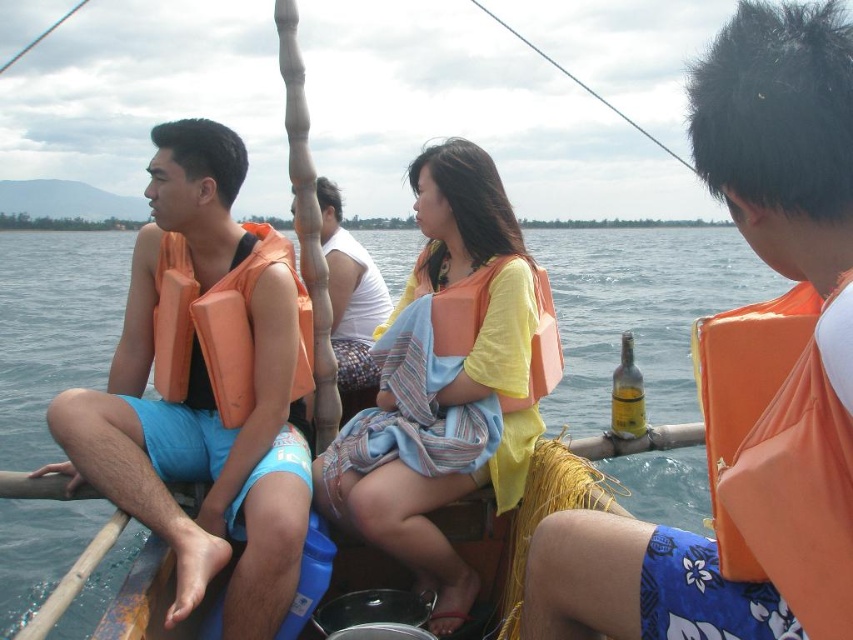
You are on a boat and need to retrieve the orange life vest at right. Which direction should you move relative to the matte orange life vest at left to reach it?

The orange life vest at right is behind the matte orange life vest at left, so you should move backward from the matte orange life vest at left to reach it.

You are a tour guide who needs to ensure safety between the two life vests. The minimum safe distance between life vests on this boat is 10 feet. Are the matte orange life vest at left and orange life vest at center spaced safely apart?

The matte orange life vest at left and orange life vest at center are 10.84 feet apart from each other, which exceeds the minimum safe distance of 10 feet. Therefore, they are spaced safely apart.

You are a safety inspector checking the boat for compliance. According to the image, which life preserver is taller, the orange life vest at right or the orange foam life jacket at left?

The orange life vest at right is taller than the orange foam life jacket at left according to the description.